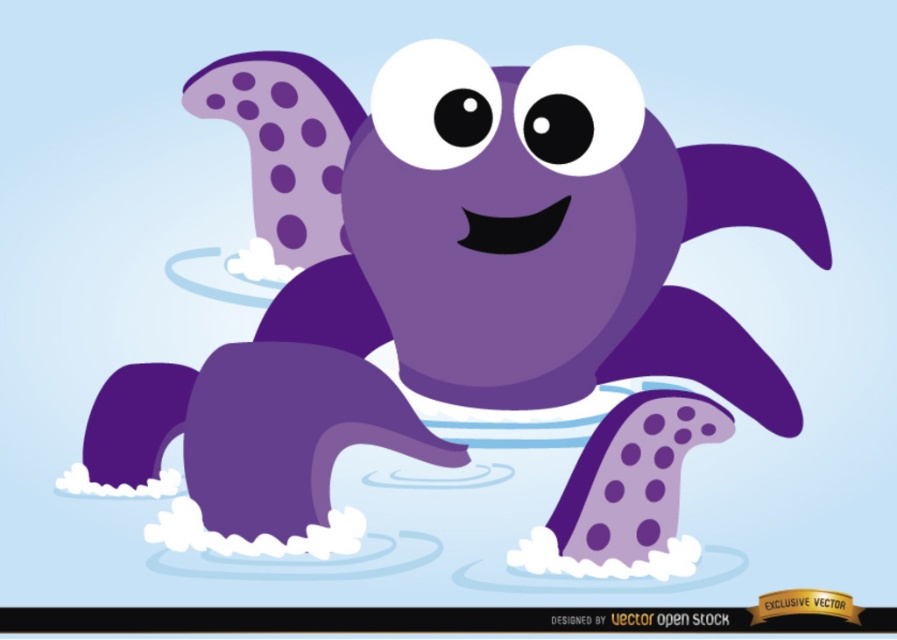
Looking at the cartoon purple crab, which has a matte black eye at center and a matte black eye at upper center, can you determine which eye is wider?

The matte black eye at center might be wider than the matte black eye at upper center.